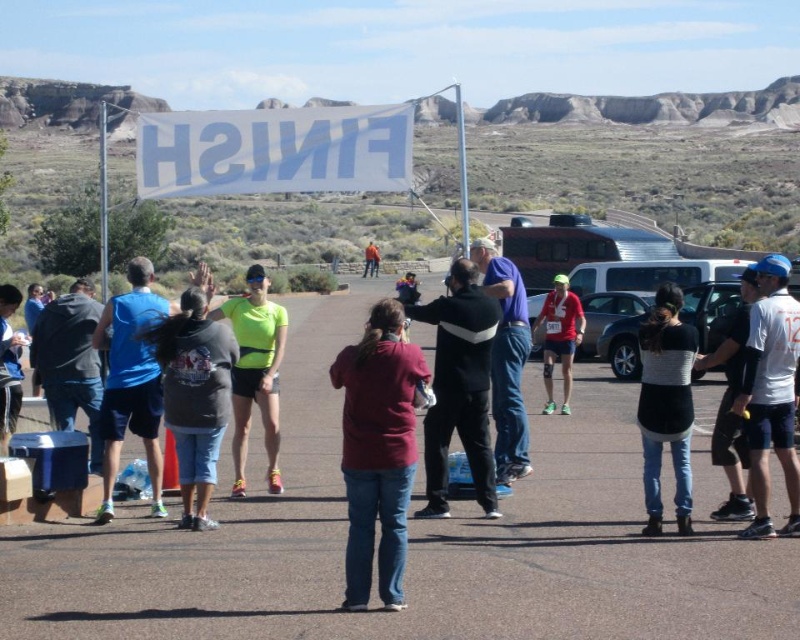
Can you confirm if maroon fabric shirt at center is smaller than dark gray hoodie at center?

No.

In the scene shown: Is maroon fabric shirt at center to the left of dark gray hoodie at center from the viewer's perspective?

No, maroon fabric shirt at center is not to the left of dark gray hoodie at center.

I want to click on maroon fabric shirt at center, so click(377, 451).

Consider the image. Does asphalt pavement at center appear on the left side of black and white striped sweater at center?

Indeed, asphalt pavement at center is positioned on the left side of black and white striped sweater at center.

Is point (296, 333) closer to camera compared to point (660, 339)?

No, (296, 333) is behind (660, 339).

The image size is (800, 640). I want to click on asphalt pavement at center, so click(417, 540).

Does maroon fabric shirt at center have a lesser height compared to neon yellow fabric at center?

No, maroon fabric shirt at center is not shorter than neon yellow fabric at center.

Can you confirm if maroon fabric shirt at center is wider than neon yellow fabric at center?

No, maroon fabric shirt at center is not wider than neon yellow fabric at center.

Is point (354, 595) positioned in front of point (237, 492)?

Yes, it is.

Image resolution: width=800 pixels, height=640 pixels. I want to click on maroon fabric shirt at center, so click(377, 451).